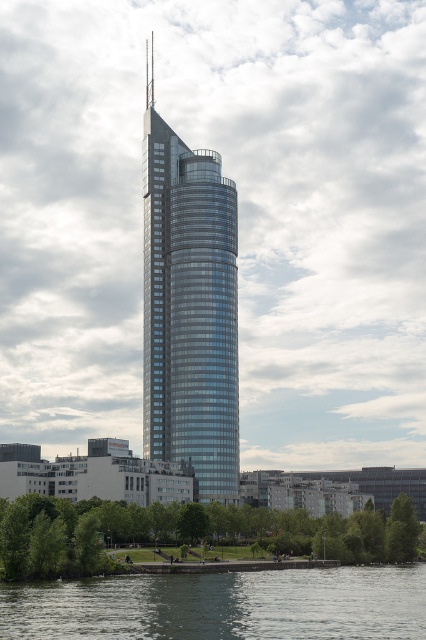
Question: Is the position of glassy steel tower at center less distant than that of green leafy tree at lower center?

Choices:
 (A) yes
 (B) no

Answer: (B)

Question: Which object appears farthest from the camera in this image?

Choices:
 (A) green leafy tree at lower center
 (B) glassy steel tower at center
 (C) clear water at lower center

Answer: (B)

Question: Can you confirm if clear water at lower center is positioned to the left of green leafy tree at lower center?

Choices:
 (A) yes
 (B) no

Answer: (B)

Question: Does glassy steel tower at center come in front of clear water at lower center?

Choices:
 (A) yes
 (B) no

Answer: (B)

Question: Which object is farther from the camera taking this photo?

Choices:
 (A) clear water at lower center
 (B) glassy steel tower at center

Answer: (B)

Question: Which point is closer to the camera taking this photo?

Choices:
 (A) (173, 509)
 (B) (397, 577)

Answer: (B)